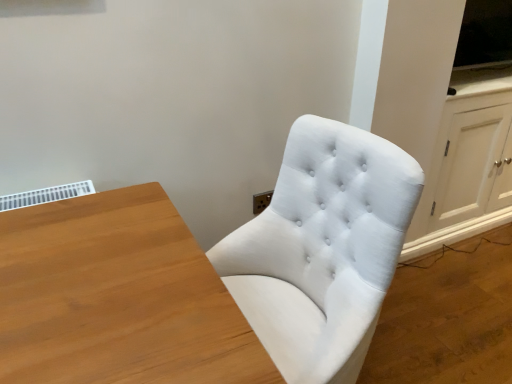
Question: Is point (304, 319) positioned closer to the camera than point (499, 97)?

Choices:
 (A) farther
 (B) closer

Answer: (B)

Question: In the image, is white fabric chair at center positioned in front of or behind white wood dresser at right?

Choices:
 (A) behind
 (B) front

Answer: (B)

Question: Is white fabric chair at center to the left or to the right of white wood dresser at right in the image?

Choices:
 (A) right
 (B) left

Answer: (B)

Question: Based on their sizes in the image, would you say white wood dresser at right is bigger or smaller than white fabric chair at center?

Choices:
 (A) small
 (B) big

Answer: (B)

Question: Would you say white wood dresser at right is to the left or to the right of white fabric chair at center in the picture?

Choices:
 (A) right
 (B) left

Answer: (A)

Question: Is white wood dresser at right in front of or behind white fabric chair at center in the image?

Choices:
 (A) behind
 (B) front

Answer: (A)

Question: From their relative heights in the image, would you say white wood dresser at right is taller or shorter than white fabric chair at center?

Choices:
 (A) short
 (B) tall

Answer: (A)